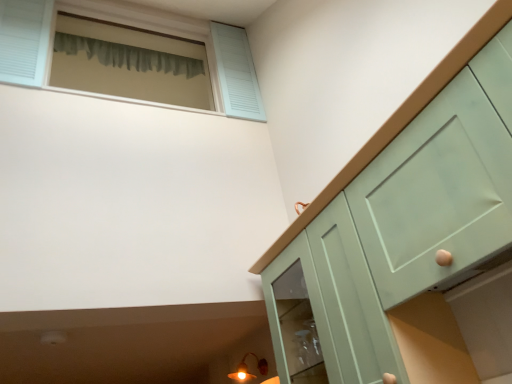
The image size is (512, 384). Describe the element at coordinates (353, 83) in the screenshot. I see `mint green cabinet at right` at that location.

The width and height of the screenshot is (512, 384). What are the coordinates of `matte gold light fixture at lower left` in the screenshot? It's located at (247, 369).

Consider the image. In order to face matte green cabinet at lower right, should I rotate leftwards or rightwards?

It's best to rotate right around 8.471 degrees.

Locate an element on the screen. This screenshot has height=384, width=512. green fabric curtain at upper left is located at coordinates (128, 56).

I want to click on light blue wooden window at upper left, so click(x=125, y=24).

From a real-world perspective, is matte gold light fixture at lower left on top of mint green cabinet at right?

Yes.

Considering the sizes of objects matte gold light fixture at lower left and mint green cabinet at right in the image provided, who is shorter, matte gold light fixture at lower left or mint green cabinet at right?

Standing shorter between the two is matte gold light fixture at lower left.

From the picture: Which is further, (264,374) or (294,177)?

Positioned behind is point (264,374).

Is matte gold light fixture at lower left closer to the viewer compared to mint green cabinet at right?

No, matte gold light fixture at lower left is behind mint green cabinet at right.

From a real-world perspective, which object rests below the other?

matte gold light fixture at lower left is physically lower.

Considering the relative positions of matte gold light fixture at lower left and green fabric curtain at upper left in the image provided, is matte gold light fixture at lower left in front of green fabric curtain at upper left?

A: Yes, the depth of matte gold light fixture at lower left is less than that of green fabric curtain at upper left.

Is matte gold light fixture at lower left inside or outside of green fabric curtain at upper left?

matte gold light fixture at lower left cannot be found inside green fabric curtain at upper left.

Is light blue wooden window at upper left further to camera compared to matte gold light fixture at lower left?

That is False.

How different are the orientations of light blue wooden window at upper left and matte gold light fixture at lower left in degrees?

The angle between the facing direction of light blue wooden window at upper left and the facing direction of matte gold light fixture at lower left is 82.3 degrees.

From the image's perspective, is light blue wooden window at upper left located above or below matte gold light fixture at lower left?

From the image's perspective, light blue wooden window at upper left appears above matte gold light fixture at lower left.

Considering the relative sizes of light blue wooden window at upper left and matte gold light fixture at lower left in the image provided, is light blue wooden window at upper left smaller than matte gold light fixture at lower left?

No.

From the image's perspective, which object appears higher, matte green cabinet at lower right or matte gold light fixture at lower left?

From the image's view, matte green cabinet at lower right is above.

Is point (329, 245) farther from camera compared to point (262, 360)?

No, it is not.

Looking at their sizes, would you say matte green cabinet at lower right is wider or thinner than matte gold light fixture at lower left?

Considering their sizes, matte green cabinet at lower right looks broader than matte gold light fixture at lower left.

Where is `curtain to the left of mint green cabinet at right`? curtain to the left of mint green cabinet at right is located at coordinates (128, 56).

Which of these two, mint green cabinet at right or green fabric curtain at upper left, stands shorter?

green fabric curtain at upper left is shorter.

From a real-world perspective, is mint green cabinet at right above or below green fabric curtain at upper left?

mint green cabinet at right is situated lower than green fabric curtain at upper left in the real world.

Which object is further away from the camera taking this photo, matte green cabinet at lower right or light blue wooden window at upper left?

→ light blue wooden window at upper left is more distant.

Considering the relative sizes of matte green cabinet at lower right and light blue wooden window at upper left in the image provided, is matte green cabinet at lower right smaller than light blue wooden window at upper left?

Indeed, matte green cabinet at lower right has a smaller size compared to light blue wooden window at upper left.

Is matte green cabinet at lower right surrounding light blue wooden window at upper left?

Actually, light blue wooden window at upper left is outside matte green cabinet at lower right.

Considering the relative sizes of matte gold light fixture at lower left and matte green cabinet at lower right in the image provided, is matte gold light fixture at lower left taller than matte green cabinet at lower right?

Incorrect, the height of matte gold light fixture at lower left is not larger of that of matte green cabinet at lower right.

Looking at this image, considering the relative sizes of matte gold light fixture at lower left and matte green cabinet at lower right in the image provided, is matte gold light fixture at lower left wider than matte green cabinet at lower right?

In fact, matte gold light fixture at lower left might be narrower than matte green cabinet at lower right.

Based on the photo, from the image's perspective, is matte gold light fixture at lower left on top of matte green cabinet at lower right?

Incorrect, from the image's perspective, matte gold light fixture at lower left is lower than matte green cabinet at lower right.

From a real-world perspective, is matte gold light fixture at lower left positioned over matte green cabinet at lower right based on gravity?

Yes, from a real-world perspective, matte gold light fixture at lower left is above matte green cabinet at lower right.

Where is `light fixture that appears on the left of mint green cabinet at right`? light fixture that appears on the left of mint green cabinet at right is located at coordinates point(247,369).

You are a GUI agent. You are given a task and a screenshot of the screen. Output one action in this format:
    pyautogui.click(x=<x>, y=<y>)
    Task: Click on the light fixture on the right side of green fabric curtain at upper left
    
    Given the screenshot: What is the action you would take?
    pyautogui.click(x=247, y=369)

Which object lies further to the anchor point mint green cabinet at right, light blue wooden window at upper left or matte gold light fixture at lower left?

matte gold light fixture at lower left is further to mint green cabinet at right.

Estimate the real-world distances between objects in this image. Which object is further from light blue wooden window at upper left, mint green cabinet at right or matte green cabinet at lower right?

matte green cabinet at lower right lies further to light blue wooden window at upper left than the other object.

Considering their positions, is mint green cabinet at right positioned further to green fabric curtain at upper left than matte green cabinet at lower right?

matte green cabinet at lower right is further to green fabric curtain at upper left.

From the image, which object appears to be nearer to green fabric curtain at upper left, matte gold light fixture at lower left or mint green cabinet at right?

mint green cabinet at right lies closer to green fabric curtain at upper left than the other object.

Which object lies further to the anchor point light blue wooden window at upper left, matte green cabinet at lower right or green fabric curtain at upper left?

matte green cabinet at lower right.

Estimate the real-world distances between objects in this image. Which object is closer to light blue wooden window at upper left, mint green cabinet at right or green fabric curtain at upper left?

green fabric curtain at upper left lies closer to light blue wooden window at upper left than the other object.

Considering their positions, is matte gold light fixture at lower left positioned closer to light blue wooden window at upper left than matte green cabinet at lower right?

matte green cabinet at lower right.

When comparing their distances from light blue wooden window at upper left, does matte green cabinet at lower right or mint green cabinet at right seem closer?

The object closer to light blue wooden window at upper left is mint green cabinet at right.

Locate an element on the screen. This screenshot has width=512, height=384. screen door located between mint green cabinet at right and matte gold light fixture at lower left in the depth direction is located at coordinates (352, 299).

You are a GUI agent. You are given a task and a screenshot of the screen. Output one action in this format:
    pyautogui.click(x=<x>, y=<y>)
    Task: Click on the screen door between light blue wooden window at upper left and matte gold light fixture at lower left from top to bottom
    The height and width of the screenshot is (384, 512).
    Given the screenshot: What is the action you would take?
    pyautogui.click(x=352, y=299)

This screenshot has height=384, width=512. I want to click on screen door positioned between mint green cabinet at right and light blue wooden window at upper left from near to far, so click(x=352, y=299).

This screenshot has height=384, width=512. In order to click on window between green fabric curtain at upper left and matte green cabinet at lower right from top to bottom in this screenshot , I will do `click(125, 24)`.